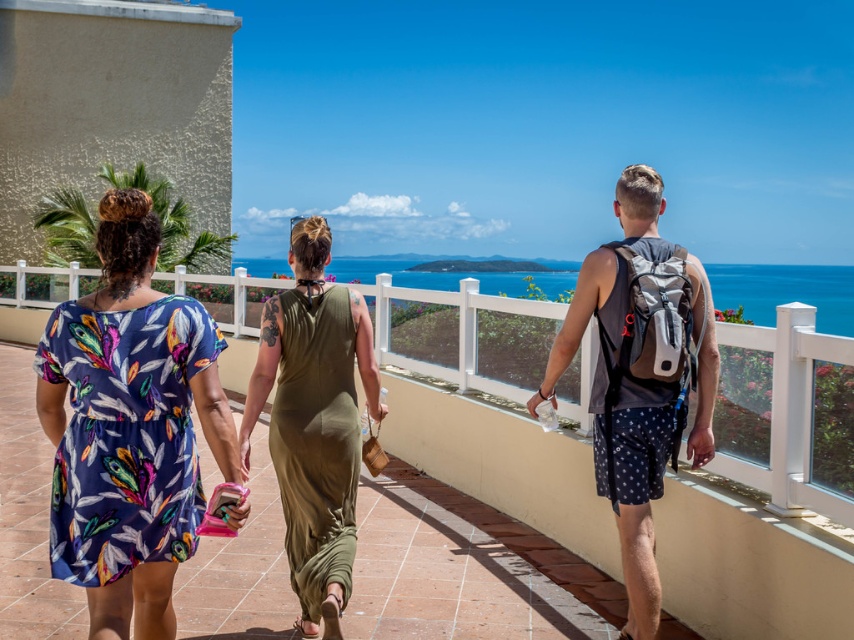
Between gray fabric backpack at center and olive green satin dress at center, which one has more height?

gray fabric backpack at center is taller.

Is gray fabric backpack at center below olive green satin dress at center?

No, gray fabric backpack at center is not below olive green satin dress at center.

What do you see at coordinates (638, 378) in the screenshot? I see `gray fabric backpack at center` at bounding box center [638, 378].

Where is `gray fabric backpack at center`? The image size is (854, 640). gray fabric backpack at center is located at coordinates (638, 378).

Between point (126, 204) and point (632, 221), which one is positioned behind?

Positioned behind is point (632, 221).

Is printed fabric dress at left bigger than gray fabric backpack at center?

No.

Where is `printed fabric dress at left`? printed fabric dress at left is located at coordinates (129, 428).

Locate an element on the screen. This screenshot has width=854, height=640. matte floral dress at center is located at coordinates (449, 572).

Does matte floral dress at center have a lesser width compared to gray fabric backpack at center?

Yes, matte floral dress at center is thinner than gray fabric backpack at center.

What do you see at coordinates (449, 572) in the screenshot?
I see `matte floral dress at center` at bounding box center [449, 572].

I want to click on matte floral dress at center, so click(x=449, y=572).